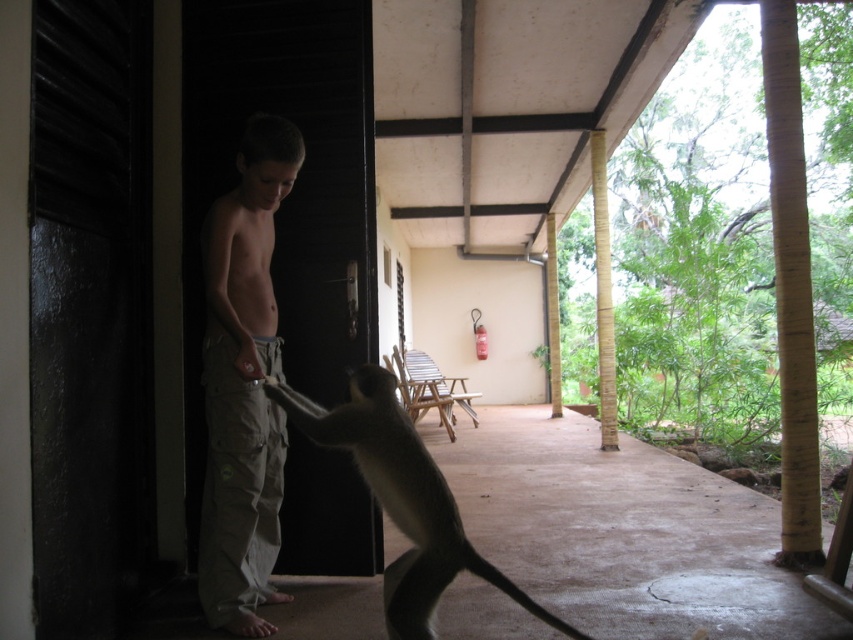
Question: Is bamboo pole at right below brown furry tail at lower center?

Choices:
 (A) no
 (B) yes

Answer: (A)

Question: Is tan cargo pants at center to the left of bamboo pole at right from the viewer's perspective?

Choices:
 (A) no
 (B) yes

Answer: (B)

Question: Can you confirm if tan cargo pants at center is smaller than bamboo pole at right?

Choices:
 (A) yes
 (B) no

Answer: (A)

Question: Which point is closer to the camera?

Choices:
 (A) yellow bamboo pillar at center-right
 (B) bamboo pole at right

Answer: (B)

Question: Among these objects, which one is farthest from the camera?

Choices:
 (A) brown furry tail at lower center
 (B) yellow bamboo pillar at center-right
 (C) tan cargo pants at center
 (D) bamboo pole at right

Answer: (B)

Question: Estimate the real-world distances between objects in this image. Which object is closer to the tan cargo pants at center?

Choices:
 (A) bamboo pole at right
 (B) yellow bamboo pillar at center-right

Answer: (A)